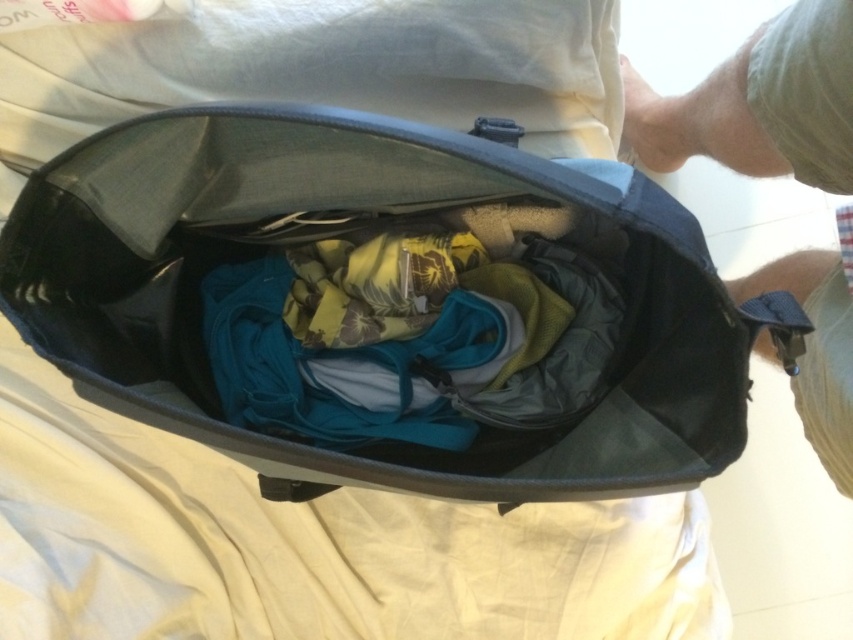
Question: Which object is farther from the camera taking this photo?

Choices:
 (A) khaki cotton shorts at lower right
 (B) matte black bag at center

Answer: (A)

Question: Can you confirm if teal fabric clothing at center is positioned to the left of khaki cotton shorts at lower right?

Choices:
 (A) no
 (B) yes

Answer: (B)

Question: Can you confirm if skinny jeans at right is bigger than khaki cotton shorts at lower right?

Choices:
 (A) no
 (B) yes

Answer: (B)

Question: Considering the real-world distances, which object is closest to the teal fabric clothing at center?

Choices:
 (A) matte black bag at center
 (B) skinny jeans at right
 (C) khaki cotton shorts at lower right

Answer: (A)

Question: Which point appears closest to the camera in this image?

Choices:
 (A) (706, 106)
 (B) (569, 317)
 (C) (625, 243)
 (D) (820, 417)

Answer: (B)

Question: Does matte black bag at center appear on the left side of skinny jeans at right?

Choices:
 (A) no
 (B) yes

Answer: (B)